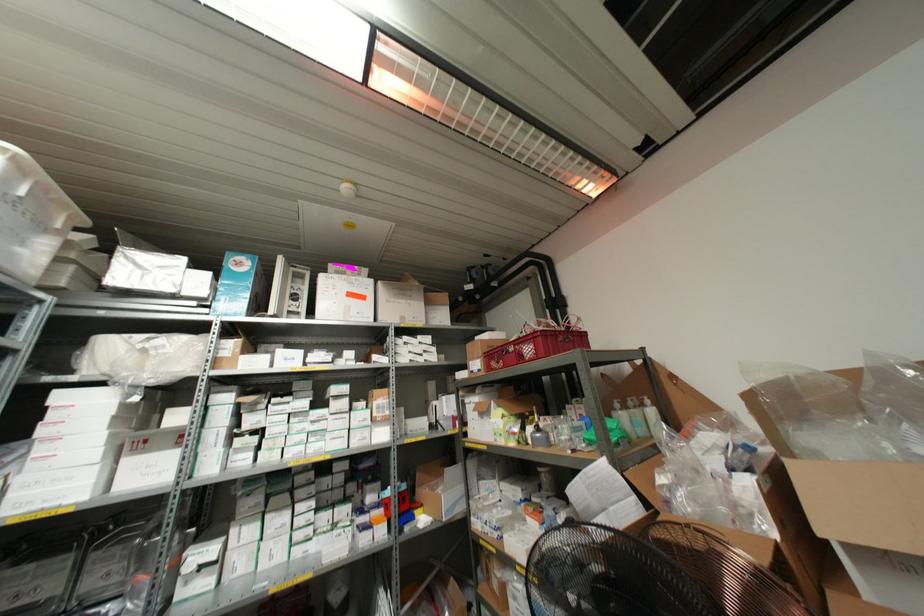
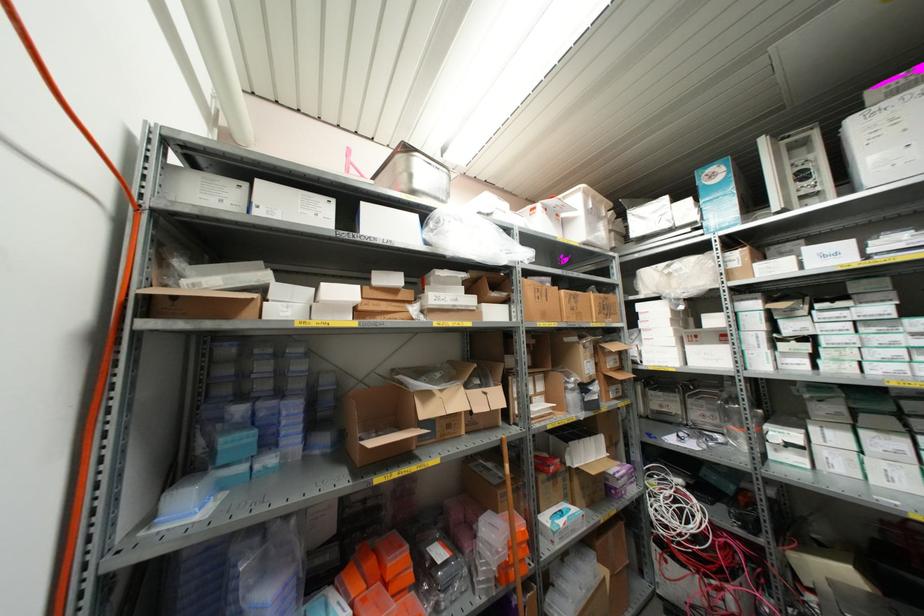
Find the pixel in the second image that matches point (232, 344) in the first image.

(737, 254)